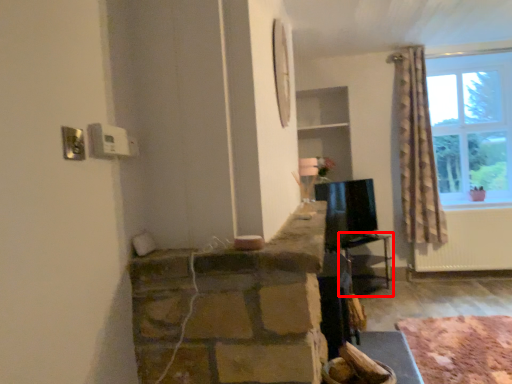
Question: In this image, where is table (annotated by the red box) located relative to plain?

Choices:
 (A) left
 (B) right

Answer: (A)